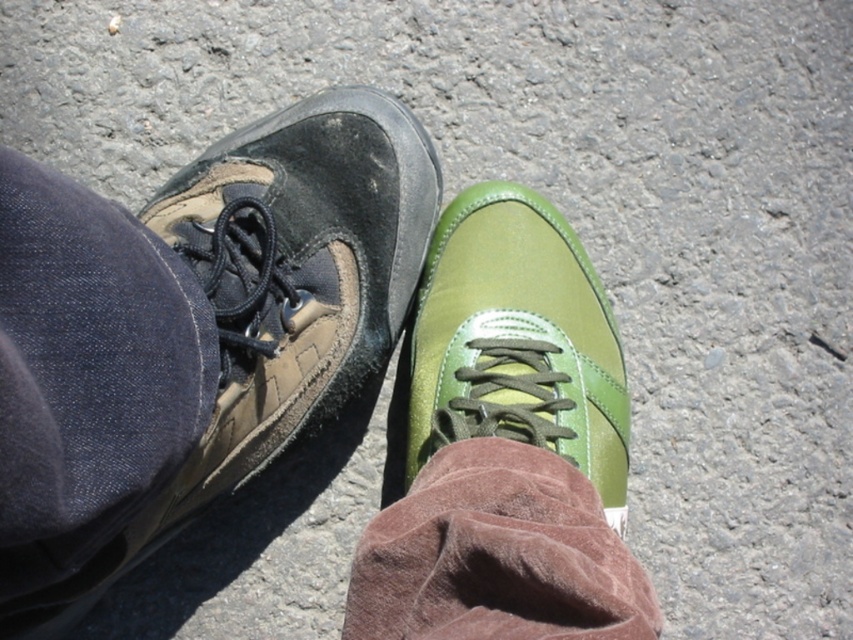
Between matte brown leather shoe at left and brown suede sock at lower center, which one has less height?

With less height is brown suede sock at lower center.

Is matte brown leather shoe at left to the left of brown suede sock at lower center from the viewer's perspective?

Correct, you'll find matte brown leather shoe at left to the left of brown suede sock at lower center.

Which is behind, point (224, 310) or point (437, 573)?

Positioned behind is point (224, 310).

Locate an element on the screen. The height and width of the screenshot is (640, 853). matte brown leather shoe at left is located at coordinates (271, 301).

Which is behind, point (402, 284) or point (532, 209)?

Point (532, 209)

Can you confirm if matte brown leather shoe at left is bigger than green leather shoe at center?

Correct, matte brown leather shoe at left is larger in size than green leather shoe at center.

Who is more distant from viewer, (x=405, y=172) or (x=468, y=193)?

Point (x=468, y=193)

Identify the location of matte brown leather shoe at left. This screenshot has width=853, height=640. (271, 301).

Does green leather shoe at center appear over brown suede sock at lower center?

Correct, green leather shoe at center is located above brown suede sock at lower center.

Does point (479, 273) lie in front of point (416, 577)?

No, (479, 273) is further to viewer.

Identify the location of green leather shoe at center. (517, 340).